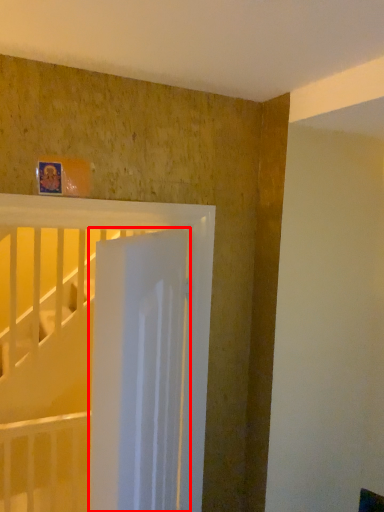
Question: From the image's perspective, where is door (annotated by the red box) located relative to bed?

Choices:
 (A) below
 (B) above

Answer: (A)